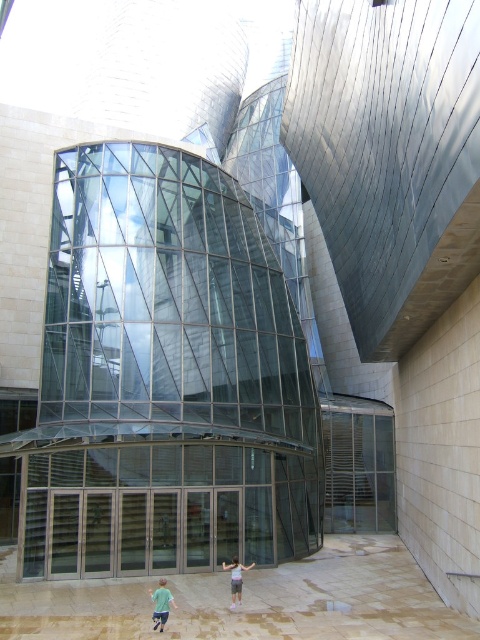
Is point (157, 620) behind point (225, 568)?

No.

Does green matte shirt at lower center appear on the left side of light blue denim shorts at center?

Correct, you'll find green matte shirt at lower center to the left of light blue denim shorts at center.

Find the location of a particular element. green matte shirt at lower center is located at coordinates (160, 604).

Image resolution: width=480 pixels, height=640 pixels. I want to click on green matte shirt at lower center, so pos(160,604).